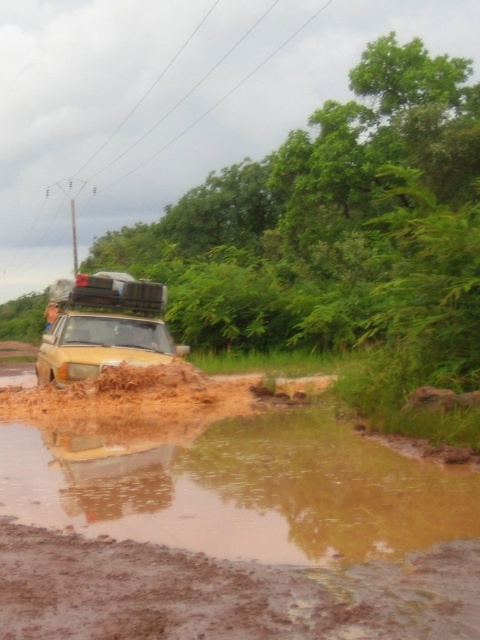
Does brown muddy dirt track at lower center have a lesser width compared to yellow matte car at center?

In fact, brown muddy dirt track at lower center might be wider than yellow matte car at center.

The image size is (480, 640). Describe the element at coordinates (226, 593) in the screenshot. I see `brown muddy dirt track at lower center` at that location.

This screenshot has height=640, width=480. In order to click on brown muddy dirt track at lower center in this screenshot , I will do `click(226, 593)`.